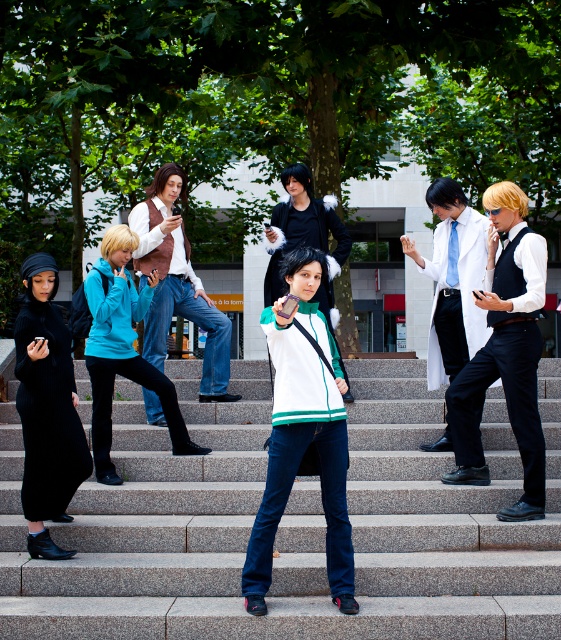
You are standing on the granite stairs at center and want to move to the denim pants at center. Which direction should you move to reach them?

The granite stairs at center is to the right of denim pants at center, so you should move to the left to reach the denim pants at center.

You are standing on the stone steps where the cosplayers are gathered. You notice two points marked in the scene. Which of the two points, point (x=232, y=376) or point (x=146, y=189), is closer to you?

Point (x=232, y=376) is closer to you because it is further to the viewer than point (x=146, y=189).

You are a photographer trying to capture a photo of the denim pants at center and the granite stairs at center. Based on their positions, which object is closer to the camera?

The denim pants at center is closer to the camera than the granite stairs at center because the granite stairs at center is located below the denim pants at center.